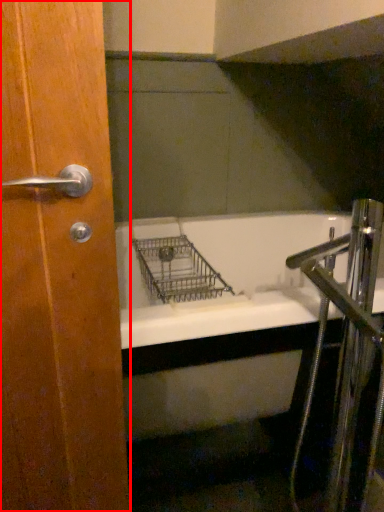
Question: From the image's perspective, where is door (annotated by the red box) located in relation to faucet in the image?

Choices:
 (A) below
 (B) above

Answer: (B)